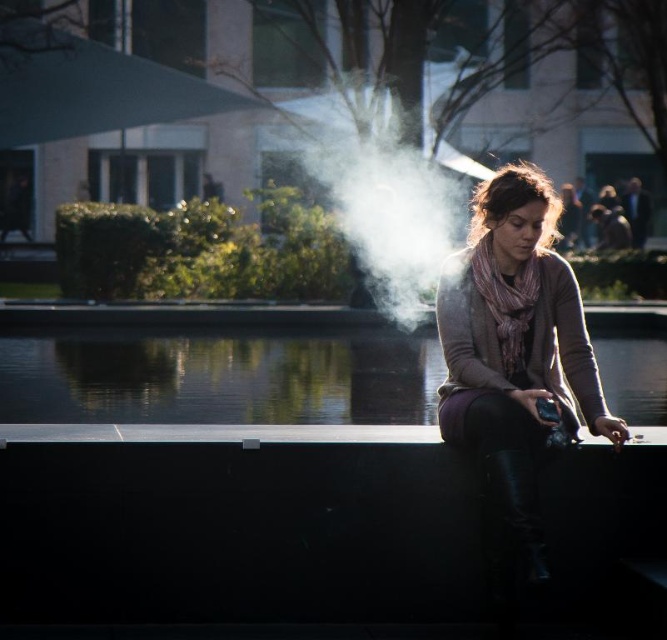
Question: Among these objects, which one is farthest from the camera?

Choices:
 (A) white vapor at center
 (B) clear glass water at center
 (C) matte gray scarf at center

Answer: (B)

Question: Based on their relative distances, which object is nearer to the white vapor at center?

Choices:
 (A) matte gray scarf at center
 (B) black smooth ledge at center
 (C) clear glass water at center

Answer: (C)

Question: Is the position of black smooth ledge at center more distant than that of white vapor at center?

Choices:
 (A) yes
 (B) no

Answer: (B)

Question: Which of the following is the farthest from the observer?

Choices:
 (A) (374, 243)
 (B) (438, 413)
 (C) (354, 582)

Answer: (A)

Question: Is matte gray scarf at center behind white vapor at center?

Choices:
 (A) yes
 (B) no

Answer: (B)

Question: Is matte gray scarf at center in front of white vapor at center?

Choices:
 (A) yes
 (B) no

Answer: (A)